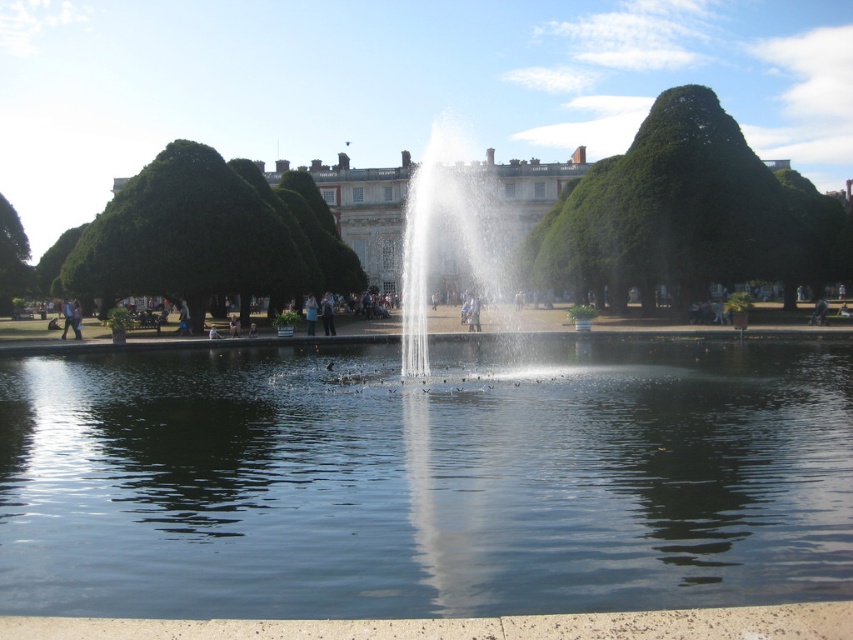
Question: Is green leafy tree at upper left smaller than dark blue jeans at center?

Choices:
 (A) no
 (B) yes

Answer: (A)

Question: Estimate the real-world distances between objects in this image. Which object is closer to the green leafy tree at upper left?

Choices:
 (A) green leafy tree at upper center
 (B) light brown leather jacket at center

Answer: (B)

Question: Can you confirm if green leafy tree at upper left is positioned to the right of dark blue jeans at center?

Choices:
 (A) no
 (B) yes

Answer: (A)

Question: Which point is closer to the camera?

Choices:
 (A) (529, 182)
 (B) (309, 326)
 (C) (50, 609)
 (D) (131, 259)

Answer: (C)

Question: Among these objects, which one is nearest to the camera?

Choices:
 (A) dark blue jeans at center
 (B) light brown wooden statue at center
 (C) light brown leather jacket at center
 (D) clear water fountain at center

Answer: (D)

Question: Is transparent glass lake at center positioned behind light blue fabric shirt at center?

Choices:
 (A) no
 (B) yes

Answer: (A)